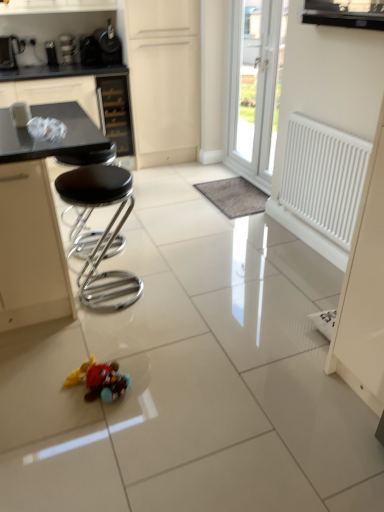
The height and width of the screenshot is (512, 384). What do you see at coordinates (101, 48) in the screenshot?
I see `metallic black coffee maker at upper left, positioned as the first appliance in right-to-left order` at bounding box center [101, 48].

Where is `metallic silver toaster at upper left, which ranks as the second appliance in left-to-right order`? Image resolution: width=384 pixels, height=512 pixels. metallic silver toaster at upper left, which ranks as the second appliance in left-to-right order is located at coordinates (67, 48).

This screenshot has width=384, height=512. Describe the element at coordinates (323, 177) in the screenshot. I see `white matte radiator at right` at that location.

This screenshot has height=512, width=384. Describe the element at coordinates (10, 51) in the screenshot. I see `brushed metal toaster at upper left, which is the third appliance from right to left` at that location.

Image resolution: width=384 pixels, height=512 pixels. Identify the location of gray fuzzy mat at center. coord(234,196).

At what (x,y) coordinates should I click in order to perform the action: click on white plastic door at upper center. Please return your answer as a coordinate pair (x, y). This screenshot has height=512, width=384. Looking at the image, I should click on (255, 87).

What are the coordinates of `black glass drawer at upper center` in the screenshot? It's located at (115, 112).

Is gray fuzzy mat at center smaller than white matte radiator at right?

Yes, gray fuzzy mat at center is smaller than white matte radiator at right.

From the image's perspective, would you say gray fuzzy mat at center is positioned over white matte radiator at right?

Yes, from the image's perspective, gray fuzzy mat at center is over white matte radiator at right.

From a real-world perspective, is gray fuzzy mat at center beneath white matte radiator at right?

Indeed, from a real-world perspective, gray fuzzy mat at center is positioned beneath white matte radiator at right.

Looking at this image, can you see gray fuzzy mat at center touching white matte radiator at right?

No.

Does point (120, 134) appear closer or farther from the camera than point (67, 54)?

Point (120, 134).

Does black glass drawer at upper center have a lesser width compared to metallic silver toaster at upper left, which is the second appliance in right-to-left order?

Incorrect, the width of black glass drawer at upper center is not less than that of metallic silver toaster at upper left, which is the second appliance in right-to-left order.

From a real-world perspective, is black glass drawer at upper center on metallic silver toaster at upper left, which is the second appliance in right-to-left order?

No.

From a real-world perspective, is matte cream cabinet at upper center over black leather stool at left?

Yes, from a real-world perspective, matte cream cabinet at upper center is on top of black leather stool at left.

Is matte cream cabinet at upper center facing towards black leather stool at left?

No, matte cream cabinet at upper center is not facing towards black leather stool at left.

Would you say matte cream cabinet at upper center contains black leather stool at left?

No.

Is black leather stool at left inside the boundaries of brushed metal toaster at upper left, which is the third appliance from right to left, or outside?

black leather stool at left is spatially situated outside brushed metal toaster at upper left, which is the third appliance from right to left.

In terms of width, does black leather stool at left look wider or thinner when compared to brushed metal toaster at upper left, which appears as the first appliance when viewed from the left?

Considering their sizes, black leather stool at left looks broader than brushed metal toaster at upper left, which appears as the first appliance when viewed from the left.

Is point (78, 280) closer or farther from the camera than point (13, 35)?

Point (78, 280).

Considering the sizes of objects black leather stool at left and brushed metal toaster at upper left, which is the third appliance from right to left, in the image provided, who is bigger, black leather stool at left or brushed metal toaster at upper left, which is the third appliance from right to left,?

With larger size is black leather stool at left.

From the image's perspective, is black glass drawer at upper center below brushed metal toaster at upper left, which appears as the first appliance when viewed from the left?

Yes.

Is the depth of black glass drawer at upper center less than that of brushed metal toaster at upper left, which appears as the first appliance when viewed from the left?

No, black glass drawer at upper center is further to the viewer.

Considering the positions of objects black glass drawer at upper center and brushed metal toaster at upper left, which is the third appliance from right to left, in the image provided, who is more to the left, black glass drawer at upper center or brushed metal toaster at upper left, which is the third appliance from right to left,?

From the viewer's perspective, brushed metal toaster at upper left, which is the third appliance from right to left, appears more on the left side.

Considering the points (102, 90) and (2, 58), which point is in front, point (102, 90) or point (2, 58)?

Positioned in front is point (2, 58).

Can you confirm if matte cream cabinet at upper center is thinner than metallic silver toaster at upper left, which ranks as the second appliance in left-to-right order?

In fact, matte cream cabinet at upper center might be wider than metallic silver toaster at upper left, which ranks as the second appliance in left-to-right order.

Which is behind, point (197, 120) or point (61, 47)?

The point (197, 120) is farther.

Is matte cream cabinet at upper center looking in the opposite direction of metallic silver toaster at upper left, which is the second appliance in right-to-left order?

matte cream cabinet at upper center is not turned away from metallic silver toaster at upper left, which is the second appliance in right-to-left order.

Choose the correct answer: Is matte cream cabinet at upper center inside metallic silver toaster at upper left, which is the second appliance in right-to-left order, or outside it?

matte cream cabinet at upper center is outside metallic silver toaster at upper left, which is the second appliance in right-to-left order.

Considering the sizes of objects gray fuzzy mat at center and white plastic door at upper center in the image provided, who is wider, gray fuzzy mat at center or white plastic door at upper center?

With larger width is gray fuzzy mat at center.

Is gray fuzzy mat at center in front of white plastic door at upper center?

No, gray fuzzy mat at center is behind white plastic door at upper center.

Between gray fuzzy mat at center and white plastic door at upper center, which one appears on the left side from the viewer's perspective?

From the viewer's perspective, gray fuzzy mat at center appears more on the left side.

The image size is (384, 512). I want to click on wide on the left of white matte radiator at right, so click(x=234, y=196).

Identify the location of drawer in front of the metallic silver toaster at upper left, which is the second appliance in right-to-left order. The image size is (384, 512). (115, 112).

Based on their spatial positions, is metallic black coffee maker at upper left, positioned as the first appliance in right-to-left order, or plush toy at center further from gray fuzzy mat at center?

plush toy at center.

Considering their positions, is plush toy at center positioned closer to white plastic door at upper center than black leather stool at left?

Based on the image, black leather stool at left appears to be nearer to white plastic door at upper center.

Based on their spatial positions, is metallic black coffee maker at upper left, the third appliance viewed from the left, or white plastic door at upper center further from plush toy at center?

The object further to plush toy at center is metallic black coffee maker at upper left, the third appliance viewed from the left.

Which object lies further to the anchor point black leather stool at left, metallic black coffee maker at upper left, positioned as the first appliance in right-to-left order, or matte cream cabinet at upper center?

metallic black coffee maker at upper left, positioned as the first appliance in right-to-left order, is further to black leather stool at left.

Consider the image. From the image, which object appears to be farther from white plastic door at upper center, plush toy at center or metallic black coffee maker at upper left, the third appliance viewed from the left?

plush toy at center is further to white plastic door at upper center.

Considering their positions, is plush toy at center positioned further to black leather stool at left than white plastic door at upper center?

Among the two, white plastic door at upper center is located further to black leather stool at left.

From the image, which object appears to be nearer to white plastic door at upper center, metallic black coffee maker at upper left, the third appliance viewed from the left, or gray fuzzy mat at center?

gray fuzzy mat at center lies closer to white plastic door at upper center than the other object.

Estimate the real-world distances between objects in this image. Which object is closer to metallic silver toaster at upper left, which is the second appliance in right-to-left order, matte cream cabinet at upper center or black leather stool at left?

matte cream cabinet at upper center is closer to metallic silver toaster at upper left, which is the second appliance in right-to-left order.

Find the location of a particular element. The height and width of the screenshot is (512, 384). door between white matte radiator at right and gray fuzzy mat at center along the z-axis is located at coordinates [255, 87].

This screenshot has height=512, width=384. I want to click on door that lies between brushed metal toaster at upper left, which appears as the first appliance when viewed from the left, and plush toy at center from top to bottom, so click(255, 87).

Identify the location of door between black leather stool at left and white matte radiator at right from left to right. Image resolution: width=384 pixels, height=512 pixels. (255, 87).

At what (x,y) coordinates should I click in order to perform the action: click on wide located between white matte radiator at right and matte cream cabinet at upper center in the depth direction. Please return your answer as a coordinate pair (x, y). Looking at the image, I should click on 234,196.